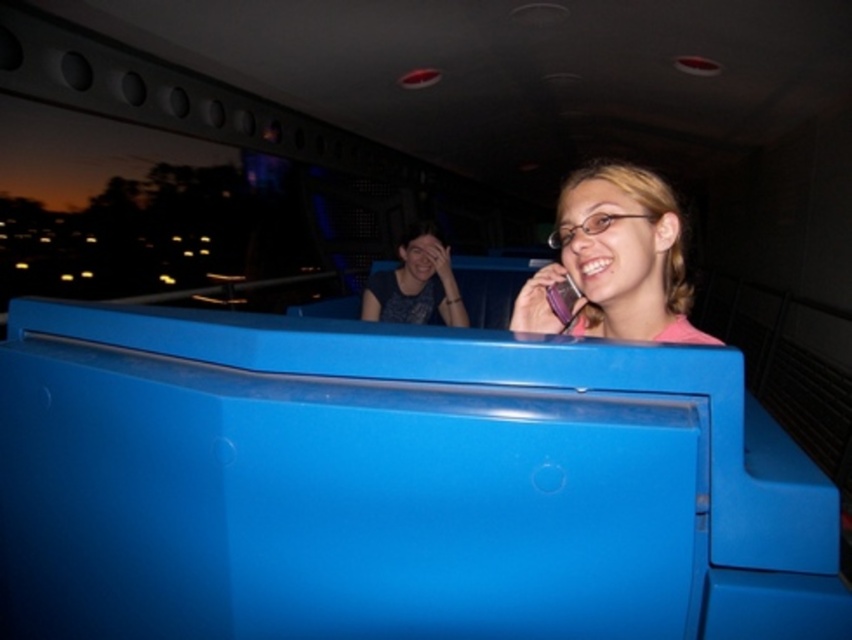
Locate an element on the screen. This screenshot has width=852, height=640. matte black shirt at center is located at coordinates (415, 284).

Which is in front, point (442, 268) or point (562, 288)?

Point (562, 288)

In order to click on matte black shirt at center in this screenshot , I will do `click(415, 284)`.

Is pink matte phone at upper right taller than matte black shirt at center?

No, pink matte phone at upper right is not taller than matte black shirt at center.

Does pink matte phone at upper right have a lesser height compared to matte black shirt at center?

Indeed, pink matte phone at upper right has a lesser height compared to matte black shirt at center.

Does point (566, 208) come behind point (450, 310)?

No, (566, 208) is closer to viewer.

At what (x,y) coordinates should I click in order to perform the action: click on pink matte phone at upper right. Please return your answer as a coordinate pair (x, y). Looking at the image, I should click on (614, 259).

Who is more forward, (655, 253) or (568, 300)?

Point (655, 253) is in front.

Who is more forward, [642,308] or [582,292]?

Point [582,292] is in front.

This screenshot has height=640, width=852. I want to click on pink matte phone at upper right, so click(x=614, y=259).